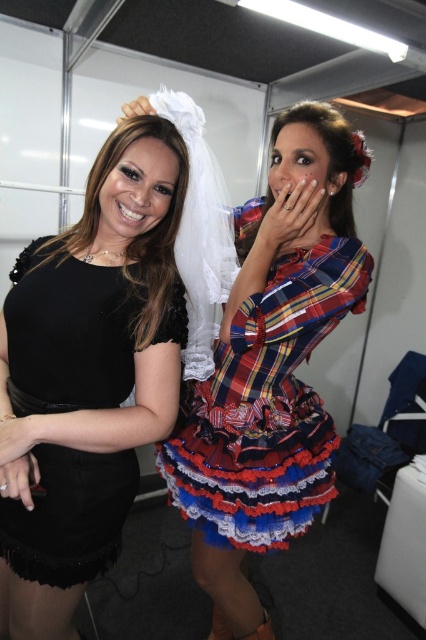
Question: Considering the relative positions of plaid fabric dress at center and black matte dress at left in the image provided, where is plaid fabric dress at center located with respect to black matte dress at left?

Choices:
 (A) below
 (B) above

Answer: (A)

Question: Does plaid fabric dress at center appear on the left side of black matte dress at left?

Choices:
 (A) no
 (B) yes

Answer: (A)

Question: Does plaid fabric dress at center appear on the left side of black matte dress at left?

Choices:
 (A) no
 (B) yes

Answer: (A)

Question: Which point appears farthest from the camera in this image?

Choices:
 (A) (350, 147)
 (B) (60, 324)

Answer: (A)

Question: Which point is farther from the camera taking this photo?

Choices:
 (A) (60, 570)
 (B) (324, 328)

Answer: (B)

Question: Which of the following is the closest to the observer?

Choices:
 (A) (58, 410)
 (B) (333, 192)

Answer: (A)